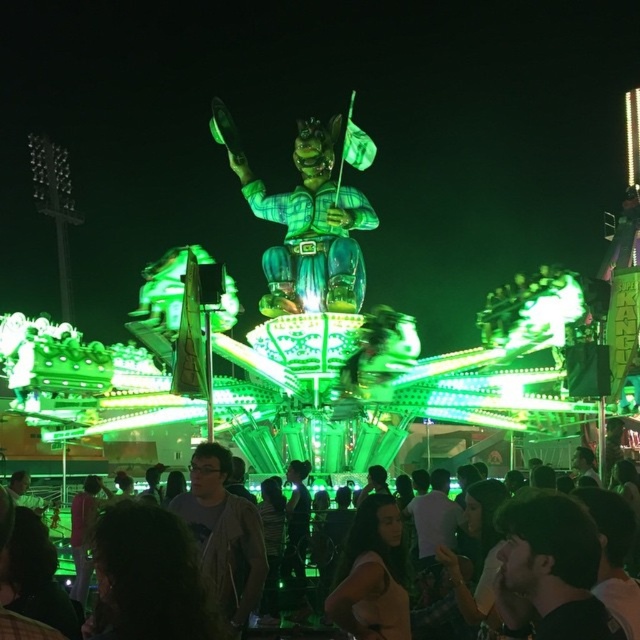
Between gray matte jacket at center and matte black shirt at center, which one appears on the left side from the viewer's perspective?

Positioned to the left is gray matte jacket at center.

Can you confirm if gray matte jacket at center is taller than matte black shirt at center?

Indeed, gray matte jacket at center has a greater height compared to matte black shirt at center.

Is point (193, 468) farther from camera compared to point (416, 502)?

No, (193, 468) is closer to viewer.

Identify the location of gray matte jacket at center. (224, 534).

In the scene shown: How far apart are dark brown hair at lower right and gray matte jacket at center?

dark brown hair at lower right is 26.42 meters from gray matte jacket at center.

Where is `dark brown hair at lower right`? dark brown hair at lower right is located at coordinates (550, 570).

Between point (497, 604) and point (241, 566), which one is positioned in front?

Positioned in front is point (497, 604).

This screenshot has width=640, height=640. I want to click on dark brown hair at lower right, so click(x=550, y=570).

Does gray matte jacket at center appear on the left side of dark hair at lower center?

Yes, gray matte jacket at center is to the left of dark hair at lower center.

Who is taller, gray matte jacket at center or dark hair at lower center?

Standing taller between the two is gray matte jacket at center.

I want to click on gray matte jacket at center, so (224, 534).